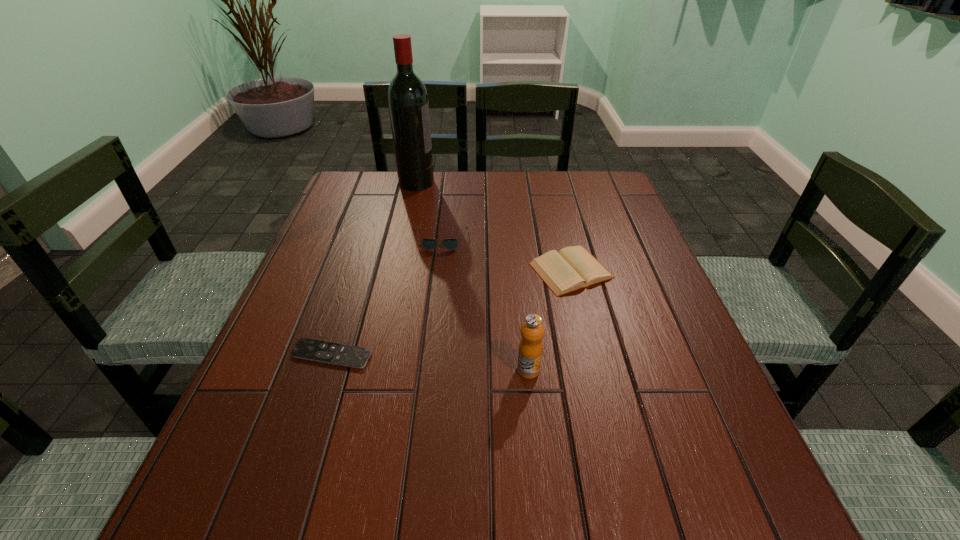
Locate an element on the screen. vacant region located on the lenses of the third shortest object is located at coordinates (435, 300).

I want to click on free spot located 0.110m on the left of the diary, so click(485, 271).

You are a GUI agent. You are given a task and a screenshot of the screen. Output one action in this format:
    pyautogui.click(x=<x>, y=<y>)
    Task: Click on the vacant area situated on the back of the remote control
    
    Given the screenshot: What is the action you would take?
    pyautogui.click(x=364, y=253)

Where is `object at the far edge`? Image resolution: width=960 pixels, height=540 pixels. object at the far edge is located at coordinates (408, 104).

Identify the location of object located in the left edge section of the desktop. (339, 354).

Image resolution: width=960 pixels, height=540 pixels. Identify the location of object located in the right edge section of the desktop. (572, 268).

I want to click on free spot at the far edge of the desktop, so click(x=544, y=191).

In the image, there is a desktop. Where is `free space at the near edge`? The image size is (960, 540). free space at the near edge is located at coordinates (481, 488).

The width and height of the screenshot is (960, 540). Identify the location of blank space at the right edge of the desktop. (610, 328).

This screenshot has height=540, width=960. I want to click on free point at the far left corner, so click(334, 202).